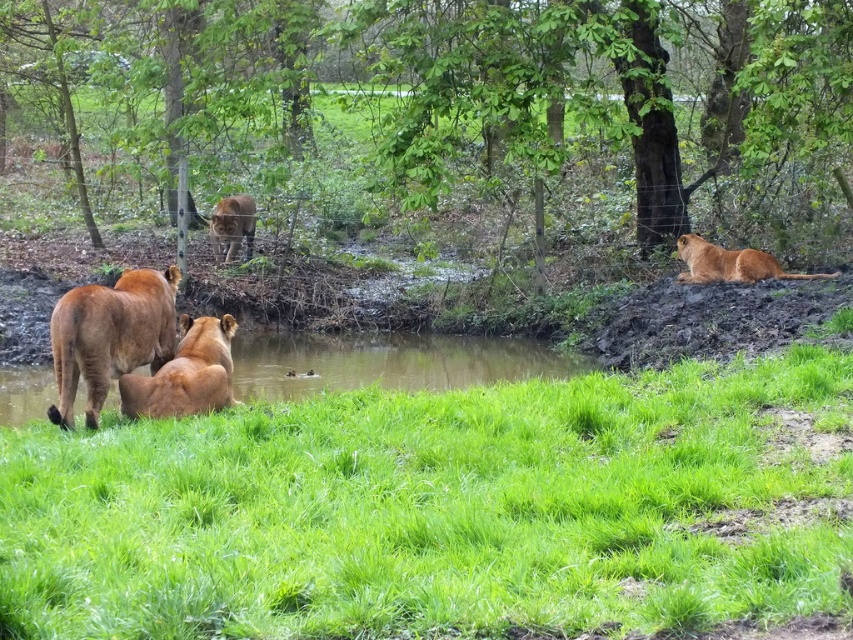
Question: Which is nearer to the green grassy water at lower center?

Choices:
 (A) brown fur lion at lower left
 (B) brown furry lion at center

Answer: (A)

Question: Is brown textured tree at upper center behind golden fur lion at right?

Choices:
 (A) yes
 (B) no

Answer: (B)

Question: Does golden fur lion at right appear over brown furry lion at center?

Choices:
 (A) no
 (B) yes

Answer: (A)

Question: Can you confirm if green grass at lower center is positioned above golden fur lion at center?

Choices:
 (A) no
 (B) yes

Answer: (A)

Question: Which point is farther from the camera taking this photo?

Choices:
 (A) (239, 220)
 (B) (164, 19)
 (C) (358, 529)

Answer: (A)

Question: Which object is farther from the camera taking this photo?

Choices:
 (A) golden fur lion at right
 (B) green grassy water at lower center
 (C) brown textured tree at upper center
 (D) brown fur lion at lower left

Answer: (A)